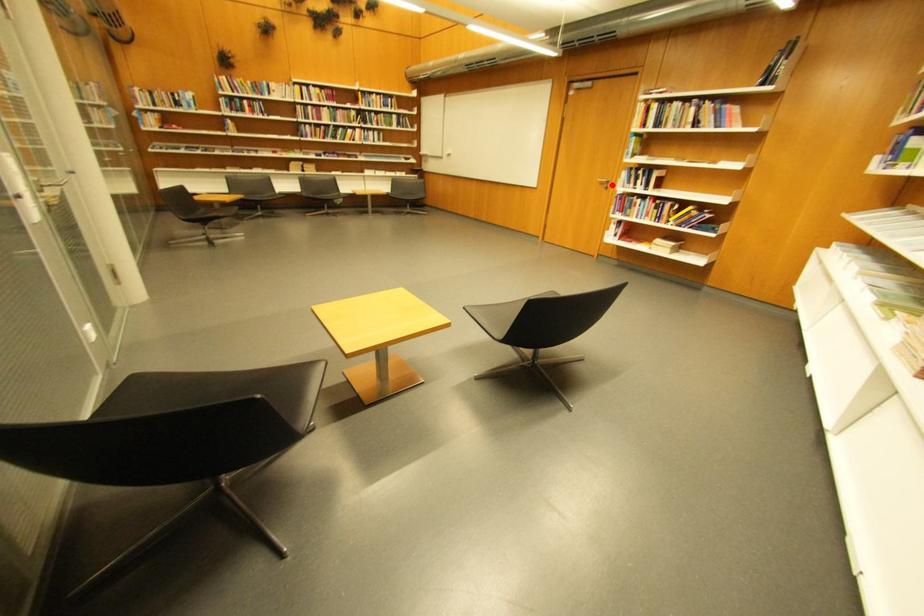
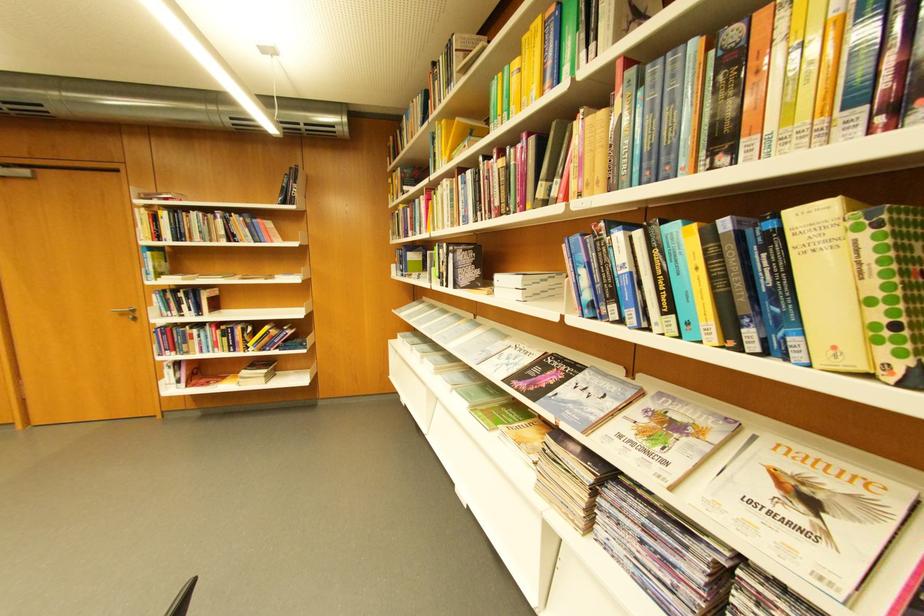
In the second image, find the point that corresponds to the highlighted location in the first image.

(132, 315)